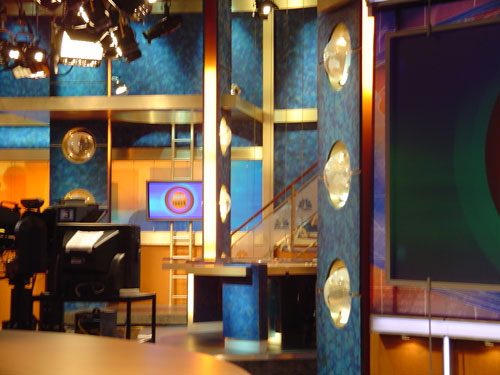
Identify the location of back of tv. The height and width of the screenshot is (375, 500). (102, 253).